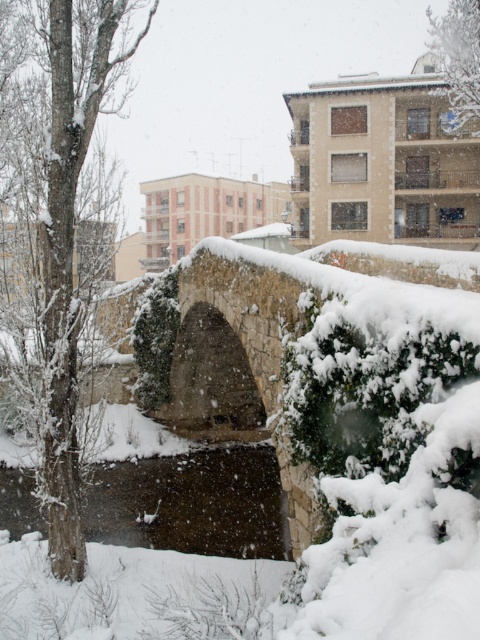
Does snow-covered bark tree at left appear on the right side of green leafy tree at upper center?

Incorrect, snow-covered bark tree at left is not on the right side of green leafy tree at upper center.

Who is more distant from viewer, (66, 234) or (435, 20)?

Point (435, 20)

Which is behind, point (64, 508) or point (478, 81)?

The point (478, 81) is behind.

Find the location of a particular element. The width and height of the screenshot is (480, 640). snow-covered bark tree at left is located at coordinates (70, 243).